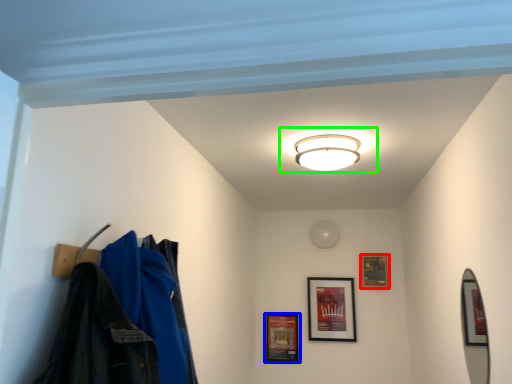
Question: Considering the real-world distances, which object is farthest from picture frame (highlighted by a red box)? picture frame (highlighted by a blue box) or lamp (highlighted by a green box)?

Choices:
 (A) picture frame
 (B) lamp

Answer: (B)